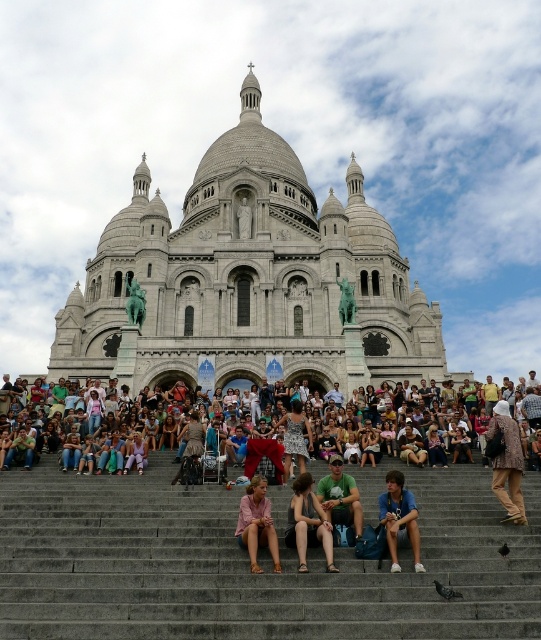
Can you confirm if blue denim jeans at lower center is smaller than green cotton shirt at center?

Indeed, blue denim jeans at lower center has a smaller size compared to green cotton shirt at center.

How far apart are blue denim jeans at lower center and green cotton shirt at center?

The distance of blue denim jeans at lower center from green cotton shirt at center is 18.22 feet.

You are a GUI agent. You are given a task and a screenshot of the screen. Output one action in this format:
    pyautogui.click(x=<x>, y=<y>)
    Task: Click on the blue denim jeans at lower center
    
    Given the screenshot: What is the action you would take?
    tap(399, 518)

You are a GUI agent. You are given a task and a screenshot of the screen. Output one action in this format:
    pyautogui.click(x=<x>, y=<y>)
    Task: Click on the blue denim jeans at lower center
    
    Given the screenshot: What is the action you would take?
    pyautogui.click(x=399, y=518)

Between point (283, 225) and point (237, 525), which one is positioned behind?

The point (283, 225) is behind.

Is point (249, 92) in front of point (249, 532)?

No, (249, 92) is behind (249, 532).

Where is `gray stone church at center`? This screenshot has height=640, width=541. gray stone church at center is located at coordinates (249, 280).

The height and width of the screenshot is (640, 541). I want to click on gray stone church at center, so click(x=249, y=280).

Is point (304, 474) positioned behind point (359, 529)?

Yes.

Locate an element on the screen. This screenshot has height=640, width=541. tan leather sandals at center is located at coordinates (307, 524).

Identify the location of tan leather sandals at center. The width and height of the screenshot is (541, 640). (307, 524).